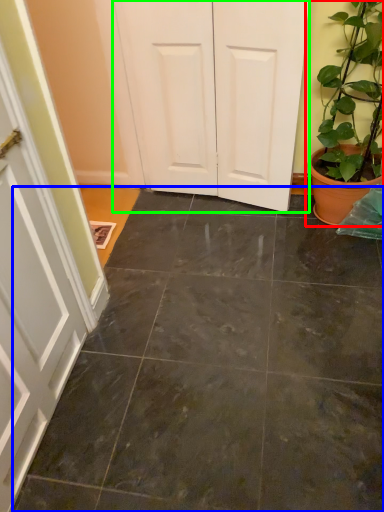
Question: Which object is positioned closest to houseplant (highlighted by a red box)? Select from concrete (highlighted by a blue box) and door (highlighted by a green box).

Choices:
 (A) concrete
 (B) door

Answer: (B)